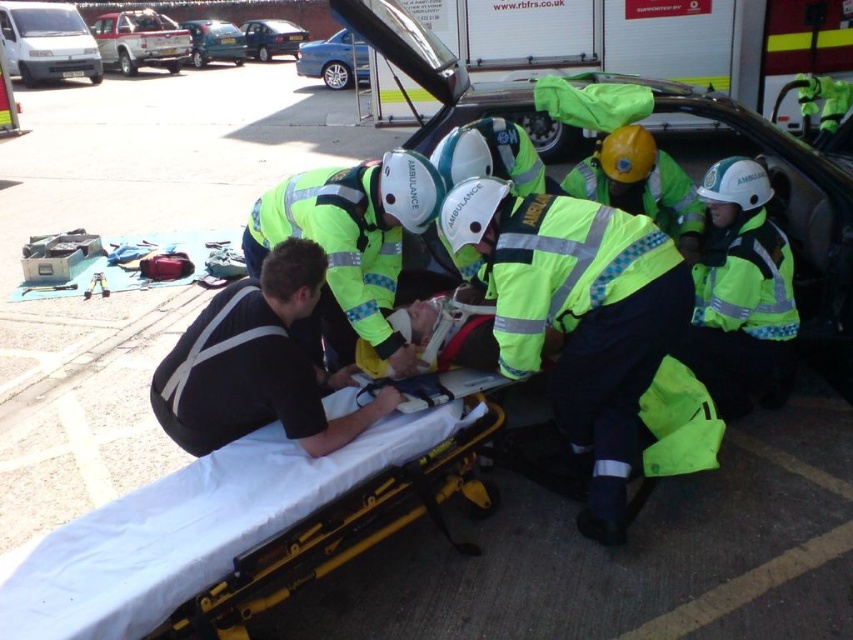
Can you confirm if high-visibility reflective jacket at center is positioned above bright yellow reflective jacket at center-right?

Incorrect, high-visibility reflective jacket at center is not positioned above bright yellow reflective jacket at center-right.

Does high-visibility reflective jacket at center appear on the left side of bright yellow reflective jacket at center-right?

Yes, high-visibility reflective jacket at center is to the left of bright yellow reflective jacket at center-right.

The width and height of the screenshot is (853, 640). What do you see at coordinates (578, 317) in the screenshot? I see `high-visibility reflective jacket at center` at bounding box center [578, 317].

You are a GUI agent. You are given a task and a screenshot of the screen. Output one action in this format:
    pyautogui.click(x=<x>, y=<y>)
    Task: Click on the high-visibility reflective jacket at center
    Image resolution: width=853 pixels, height=640 pixels.
    Given the screenshot: What is the action you would take?
    pyautogui.click(x=578, y=317)

Who is taller, metallic blue car at upper left or metallic silver sedan at upper left?

With more height is metallic blue car at upper left.

Is point (200, 49) positioned behind point (260, 45)?

No, (200, 49) is in front of (260, 45).

Locate an element on the screen. metallic blue car at upper left is located at coordinates pos(215,42).

Which of these two, yellow metallic stretcher at lower left or high-visibility reflective jacket at center, stands shorter?

Standing shorter between the two is yellow metallic stretcher at lower left.

The height and width of the screenshot is (640, 853). Describe the element at coordinates (238, 529) in the screenshot. I see `yellow metallic stretcher at lower left` at that location.

Identify the location of yellow metallic stretcher at lower left. (238, 529).

Find the location of a particular element. yellow metallic stretcher at lower left is located at coordinates (238, 529).